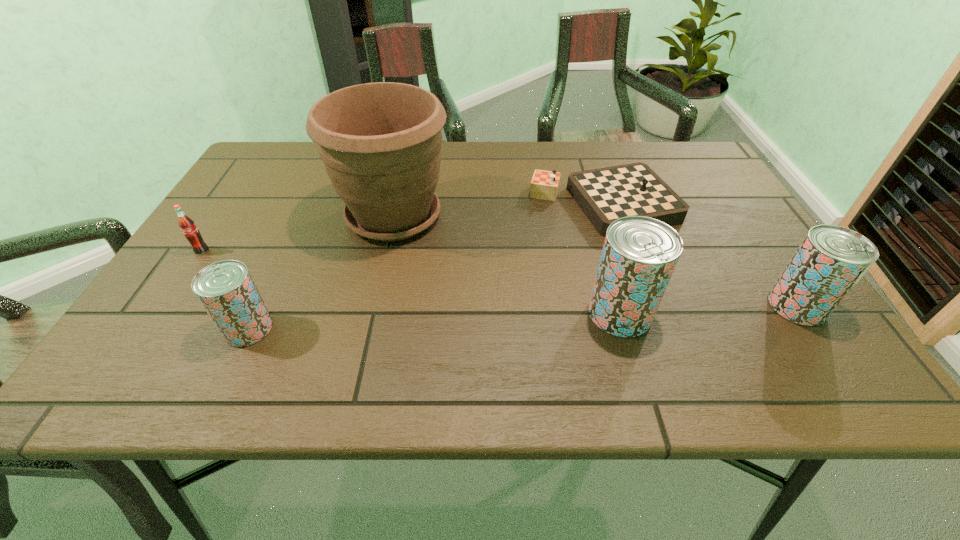
Locate an element on the screen. This screenshot has height=540, width=960. the fifth object from right to left is located at coordinates (226, 290).

Find the location of a particular element. Image resolution: width=960 pixels, height=540 pixels. the shortest beer can is located at coordinates (226, 290).

Where is `the second beer can from left to right`? This screenshot has width=960, height=540. the second beer can from left to right is located at coordinates (639, 255).

Locate an element on the screen. Image resolution: width=960 pixels, height=540 pixels. the rightmost object is located at coordinates (831, 259).

Locate an element on the screen. the second shortest beer can is located at coordinates (831, 259).

The width and height of the screenshot is (960, 540). In order to click on soda bottle in this screenshot , I will do `click(186, 224)`.

In order to click on chessboard in this screenshot , I will do `click(606, 194)`.

The height and width of the screenshot is (540, 960). In order to click on flowerpot in this screenshot , I will do `click(380, 143)`.

The width and height of the screenshot is (960, 540). Find the location of `the third object from left to right`. the third object from left to right is located at coordinates (380, 143).

Identify the location of blank space located on the back of the fifth object from right to left. [299, 223].